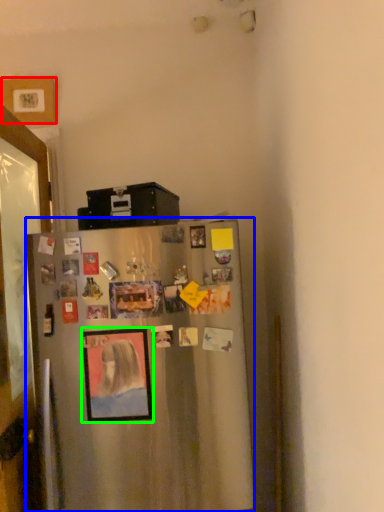
Question: Which object is positioned farthest from picture frame (highlighted by a red box)? Select from refrigerator (highlighted by a blue box) and picture frame (highlighted by a green box).

Choices:
 (A) refrigerator
 (B) picture frame

Answer: (B)